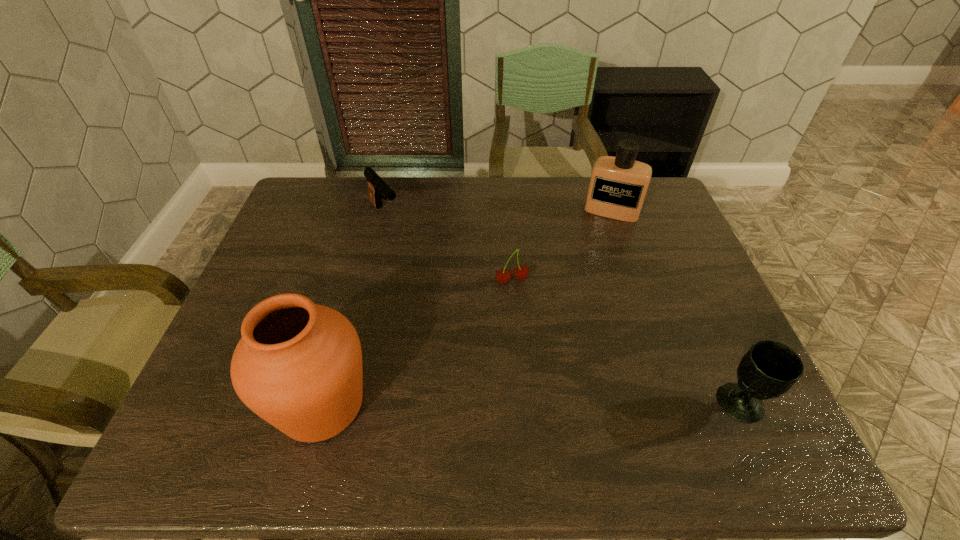
I want to click on urn, so click(298, 365).

You are a GUI agent. You are given a task and a screenshot of the screen. Output one action in this format:
    pyautogui.click(x=<x>, y=<y>)
    Task: Click on the third shortest object
    
    Given the screenshot: What is the action you would take?
    pyautogui.click(x=769, y=369)

I want to click on the shortest object, so click(521, 272).

Where is `cherry`? Image resolution: width=960 pixels, height=540 pixels. cherry is located at coordinates (521, 272).

Image resolution: width=960 pixels, height=540 pixels. In order to click on perfume in this screenshot , I will do `click(618, 185)`.

Locate an element on the screen. pistol is located at coordinates (377, 186).

Identify the location of free spot located 0.360m on the right of the urn. The height and width of the screenshot is (540, 960). (541, 404).

The width and height of the screenshot is (960, 540). Identify the location of free space located 0.350m on the left of the third tallest object. (556, 404).

The height and width of the screenshot is (540, 960). In order to click on free space located 0.300m on the surface of the cherry in this screenshot , I will do `click(551, 384)`.

I want to click on vacant position located 0.200m on the surface of the cherry, so click(538, 348).